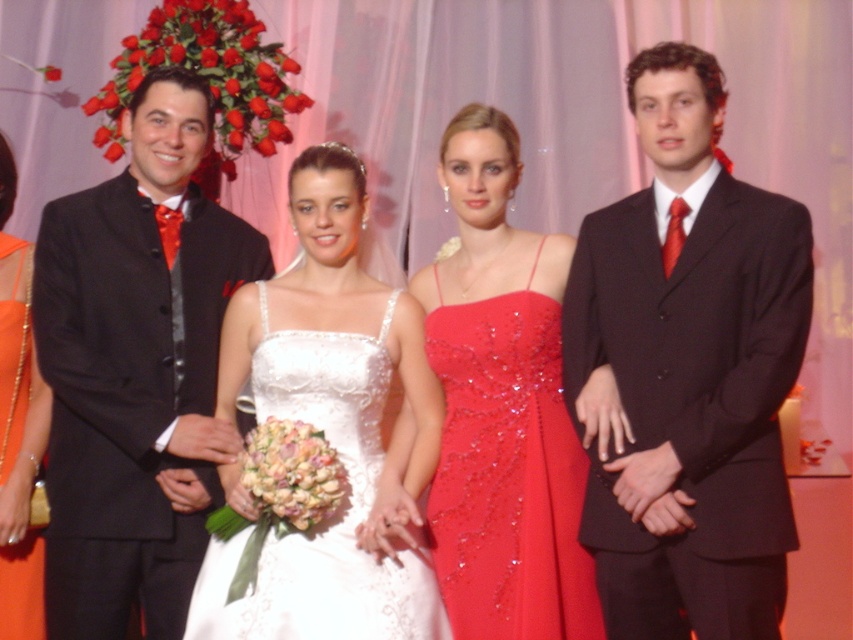
Question: Does shiny sequined dress at center appear over satin white dress at center?

Choices:
 (A) no
 (B) yes

Answer: (B)

Question: Which point is farther to the camera?

Choices:
 (A) (163, 468)
 (B) (27, 490)
 (C) (759, 266)
 (D) (212, 572)

Answer: (B)

Question: Among these objects, which one is farthest from the camera?

Choices:
 (A) shiny sequined dress at center
 (B) shiny black suit at left
 (C) shiny black suit at right

Answer: (B)

Question: In this image, where is shiny black suit at right located relative to orange satin dress at left?

Choices:
 (A) above
 (B) below

Answer: (A)

Question: Which of the following is the farthest from the observer?

Choices:
 (A) satin white dress at center
 (B) shiny black suit at right
 (C) orange satin dress at left

Answer: (C)

Question: Does shiny black suit at left lie in front of orange satin dress at left?

Choices:
 (A) yes
 (B) no

Answer: (A)